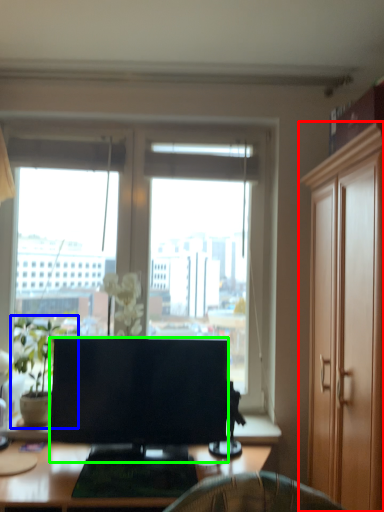
Question: Which object is positioned farthest from cabinetry (highlighted by a red box)? Select from houseplant (highlighted by a blue box) and television (highlighted by a green box).

Choices:
 (A) houseplant
 (B) television

Answer: (A)